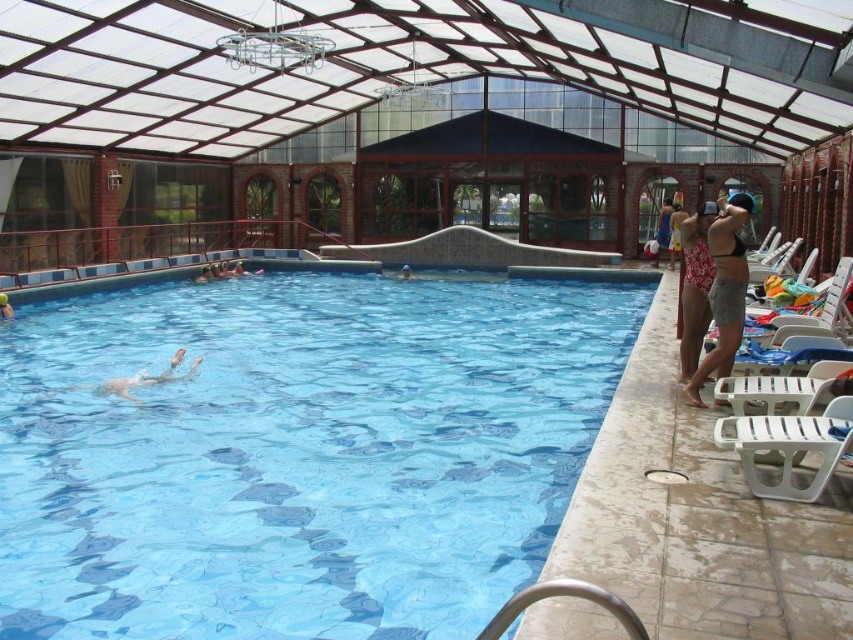
You are standing at the entrance of the indoor pool area and want to find the blue glossy water at center. According to the coordinates provided, where should you look to locate it?

The blue glossy water at center is located at point coordinates (x=297, y=452), so you should look towards the lower right area of the image since the x coordinate is 0.708 and the y coordinate is 0.349.

You are standing at the center of the pool area and want to find the matte blue swimsuit at right. According to the coordinates provided, in which direction should you move to locate it?

The matte blue swimsuit at right is located at coordinates point (x=660, y=230). Since you are at the center, moving towards the right side of the pool area would lead you to the matte blue swimsuit at right.